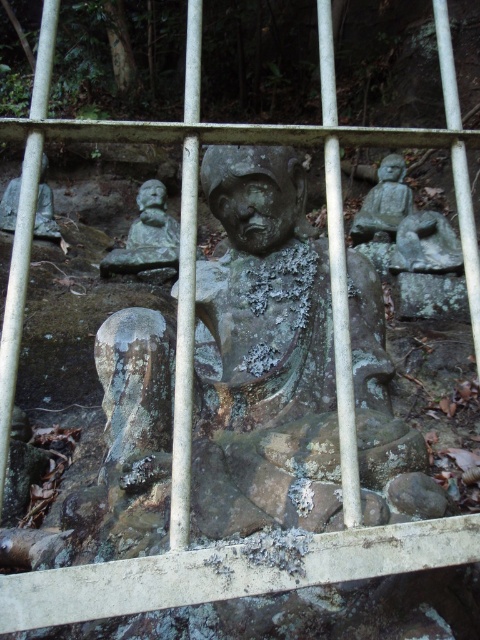
You are standing in front of the statue and want to take a photo of the smooth gray stone statue at right. Where should you position yourself to ensure the statue is fully visible without any obstruction from the metal railing?

To ensure the smooth gray stone statue at right is fully visible without obstruction from the metal railing, position yourself such that the statue is centered at the point specified by its 2D coordinates, which is at location 0.319 on the x axis and 0.800 on the y axis. This should place it in the frame without being blocked by the railing.

Based on the photo, you are a visitor at this historical site and want to take a photo of both the green mossy rock at center and the matte gray statue at left. However, the metal railing is blocking your view. Can you determine which object is closer to the ground and might be easier to photograph from a lower angle?

The green mossy rock at center is located below the matte gray statue at left, so it is closer to the ground and easier to photograph from a lower angle.

You are an archaeologist examining the statue through the metal railing. There is a green mossy rock at center. Can you see the entire statue clearly through the railing? Please explain your answer.

The green mossy rock at center is located at point (430, 296), which is likely blocking part of the statue. Since the metal railing has vertical bars that partially obscure the view, you cannot see the entire statue clearly through the railing.